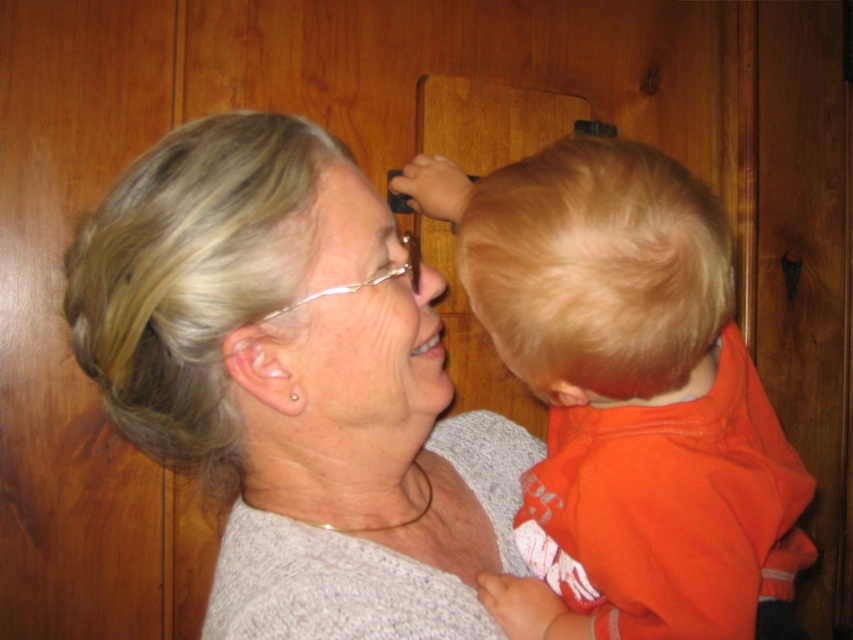
You are standing in the room and see two points marked in the image. Which point is closer to you, point (608, 365) or point (349, 170)?

Point (608, 365) is in front of point (349, 170), so it is closer to you.

In the scene described, there are two people wearing a gray knit sweater at upper left and an orange cotton shirt at right. From the perspective of someone standing in the room, which clothing item is positioned to the left?

The gray knit sweater at upper left is positioned to the left of the orange cotton shirt at right.

Where is the gray knit sweater at upper left located in the image?

The gray knit sweater at upper left is located at point (292, 396).